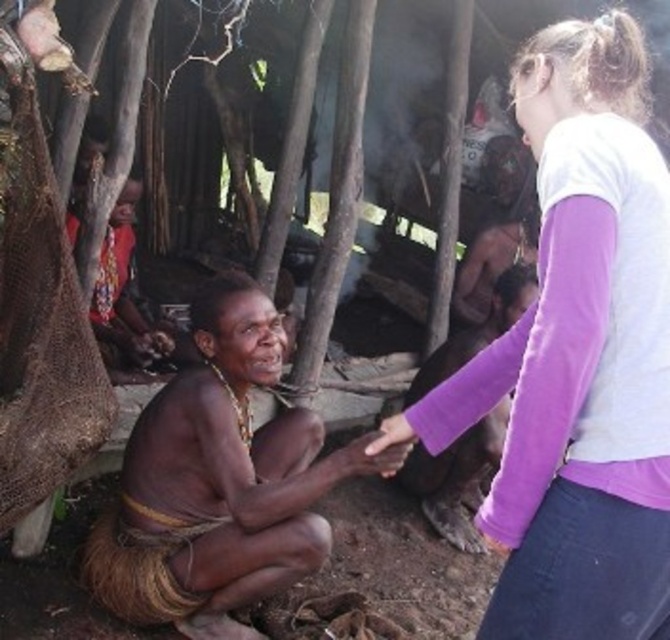
Question: Is white cotton shirt at upper right smaller than brown skin man at center?

Choices:
 (A) yes
 (B) no

Answer: (A)

Question: Can you confirm if white cotton shirt at upper right is positioned to the left of brown skin man at center?

Choices:
 (A) yes
 (B) no

Answer: (B)

Question: From the image, what is the correct spatial relationship of white cotton shirt at upper right in relation to brown skin man at center?

Choices:
 (A) left
 (B) right

Answer: (B)

Question: Among these points, which one is nearest to the camera?

Choices:
 (A) (665, 186)
 (B) (135, 580)

Answer: (A)

Question: Which point is closer to the camera?

Choices:
 (A) brown skin man at center
 (B) white cotton shirt at upper right

Answer: (B)